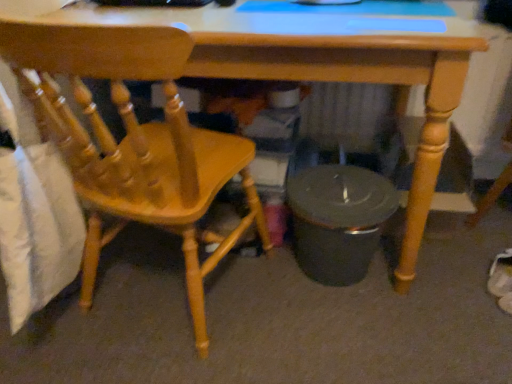
Find the location of a particular element. The width and height of the screenshot is (512, 384). free space that is in between matte wood chair at left and wooden desk at center is located at coordinates click(286, 322).